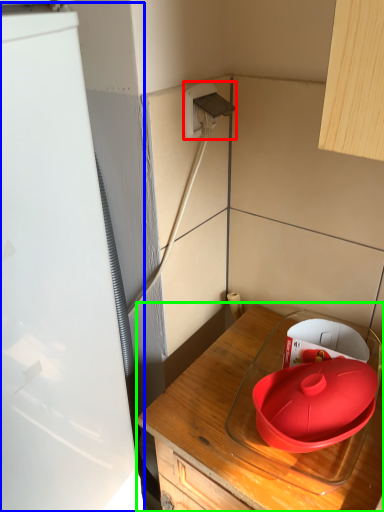
Question: Considering the real-world distances, which object is farthest from electric outlet (highlighted by a red box)? appliance (highlighted by a blue box) or countertop (highlighted by a green box)?

Choices:
 (A) appliance
 (B) countertop

Answer: (B)